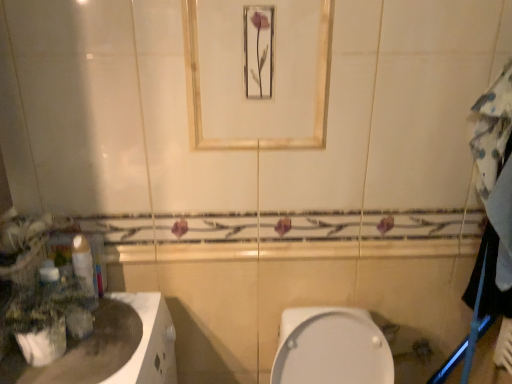
Question: From a real-world perspective, does green matte plant at left sit lower than white glossy countertop at lower left?

Choices:
 (A) yes
 (B) no

Answer: (B)

Question: From the image's perspective, is green matte plant at left under white glossy countertop at lower left?

Choices:
 (A) no
 (B) yes

Answer: (A)

Question: Is green matte plant at left behind white glossy countertop at lower left?

Choices:
 (A) no
 (B) yes

Answer: (B)

Question: From a real-world perspective, is green matte plant at left on top of white glossy countertop at lower left?

Choices:
 (A) no
 (B) yes

Answer: (B)

Question: Can you confirm if green matte plant at left is positioned to the left of white glossy countertop at lower left?

Choices:
 (A) yes
 (B) no

Answer: (B)

Question: Is green matte plant at left not near white glossy countertop at lower left?

Choices:
 (A) yes
 (B) no

Answer: (B)

Question: Considering the relative sizes of white glossy toilet paper at left and matte gold mirror at upper center in the image provided, is white glossy toilet paper at left smaller than matte gold mirror at upper center?

Choices:
 (A) yes
 (B) no

Answer: (A)

Question: From a real-world perspective, is white glossy toilet paper at left positioned under matte gold mirror at upper center based on gravity?

Choices:
 (A) yes
 (B) no

Answer: (A)

Question: Considering the relative sizes of white glossy toilet paper at left and matte gold mirror at upper center in the image provided, is white glossy toilet paper at left taller than matte gold mirror at upper center?

Choices:
 (A) no
 (B) yes

Answer: (A)

Question: From the image's perspective, is white glossy toilet paper at left on matte gold mirror at upper center?

Choices:
 (A) yes
 (B) no

Answer: (B)

Question: Is white glossy toilet paper at left not near matte gold mirror at upper center?

Choices:
 (A) no
 (B) yes

Answer: (A)

Question: Is white glossy toilet paper at left behind matte gold mirror at upper center?

Choices:
 (A) yes
 (B) no

Answer: (A)

Question: Is matte gold mirror at upper center completely or partially inside white glossy countertop at lower left?

Choices:
 (A) yes
 (B) no

Answer: (B)